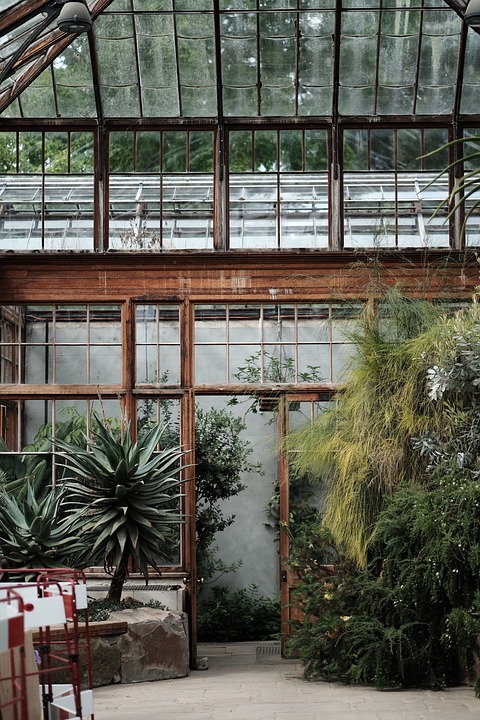
The image size is (480, 720). In order to click on ceiling lights in this screenshot , I will do `click(74, 8)`, `click(476, 9)`.